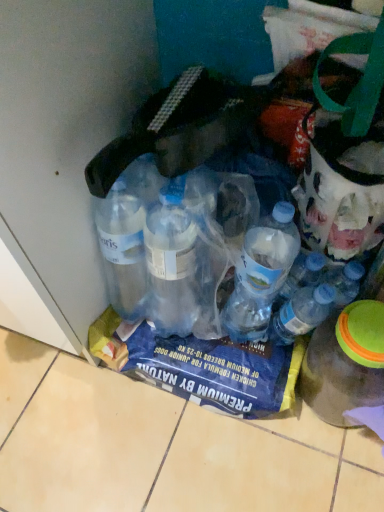
At what (x,y) coordinates should I click in order to perform the action: click on vacant position to the left of transparent plastic bottle at lower right, arranged as the 3th bottle when viewed from the left. Please return your answer as a coordinate pair (x, y). This screenshot has height=512, width=384. Looking at the image, I should click on (252, 445).